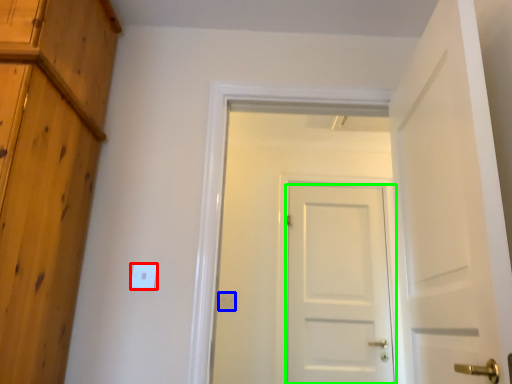
Question: Based on their relative distances, which object is nearer to light switch (highlighted by a red box)? Choose from electric outlet (highlighted by a blue box) and door (highlighted by a green box).

Choices:
 (A) electric outlet
 (B) door

Answer: (A)